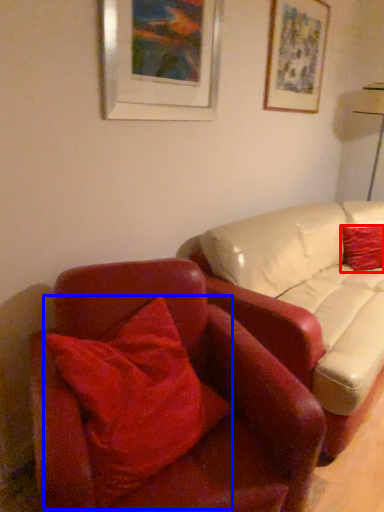
Question: Which point is closer to the camera, pillow (highlighted by a red box) or pillow (highlighted by a blue box)?

Choices:
 (A) pillow
 (B) pillow

Answer: (B)